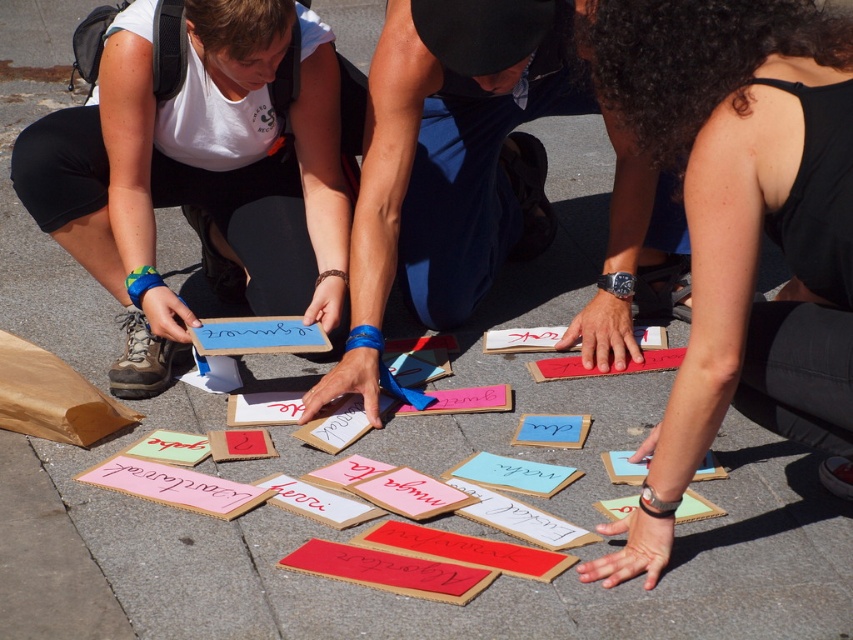
Question: Which point appears closest to the camera in this image?

Choices:
 (A) (795, 397)
 (B) (123, 221)
 (C) (451, 310)

Answer: (A)

Question: Does black fabric at center appear under cardboard sign at center?

Choices:
 (A) no
 (B) yes

Answer: (B)

Question: Is the position of black fabric at center more distant than that of white matte paper at center?

Choices:
 (A) yes
 (B) no

Answer: (B)

Question: Among these points, which one is nearest to the camera?

Choices:
 (A) (412, 86)
 (B) (850, 205)
 (C) (123, 241)

Answer: (B)

Question: Which point is farther to the camera?

Choices:
 (A) pos(257,76)
 (B) pos(641,291)

Answer: (B)

Question: Where is black fabric at center located in relation to cardboard sign at center in the image?

Choices:
 (A) left
 (B) right

Answer: (B)